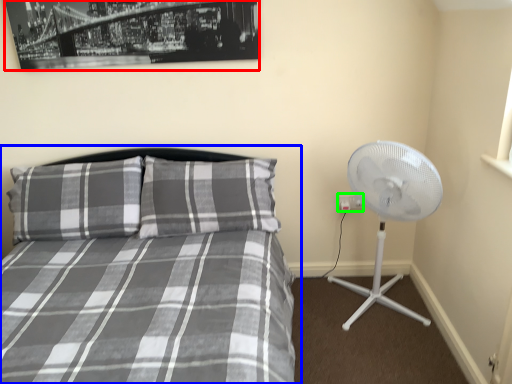
Question: Considering the real-world distances, which object is closest to picture frame (highlighted by a red box)? bed (highlighted by a blue box) or electric outlet (highlighted by a green box).

Choices:
 (A) bed
 (B) electric outlet

Answer: (A)